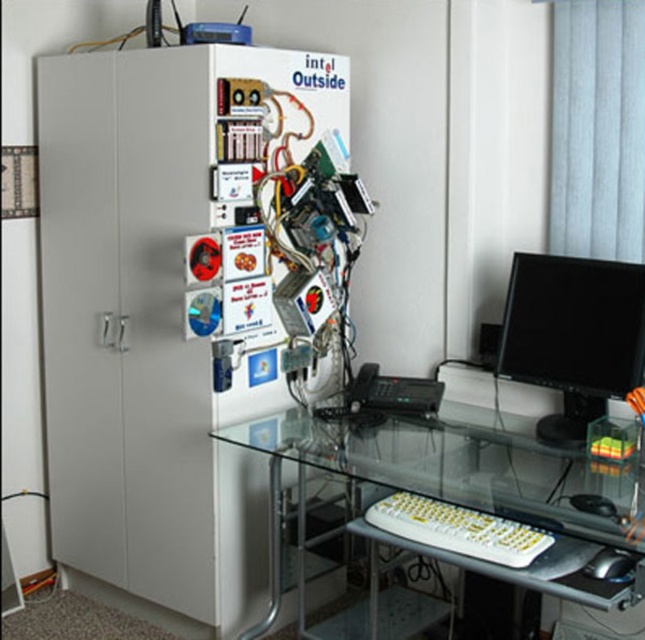
Question: Does transparent glass computer desk at lower center have a smaller size compared to black glossy monitor at right?

Choices:
 (A) no
 (B) yes

Answer: (A)

Question: Can you confirm if transparent glass computer desk at lower center is bigger than black glossy monitor at right?

Choices:
 (A) no
 (B) yes

Answer: (B)

Question: Among these objects, which one is nearest to the camera?

Choices:
 (A) black plastic mouse at lower right
 (B) white plastic keyboard at lower center
 (C) black glossy monitor at right
 (D) transparent glass computer desk at lower center

Answer: (D)

Question: Does black glossy monitor at right have a greater width compared to white plastic keyboard at lower center?

Choices:
 (A) yes
 (B) no

Answer: (B)

Question: Which object is positioned farthest from the white plastic keyboard at lower center?

Choices:
 (A) transparent glass computer desk at lower center
 (B) white matte refrigerator at left
 (C) black glossy monitor at right

Answer: (B)

Question: Which of the following is the closest to the observer?

Choices:
 (A) white matte refrigerator at left
 (B) black glossy monitor at right

Answer: (B)